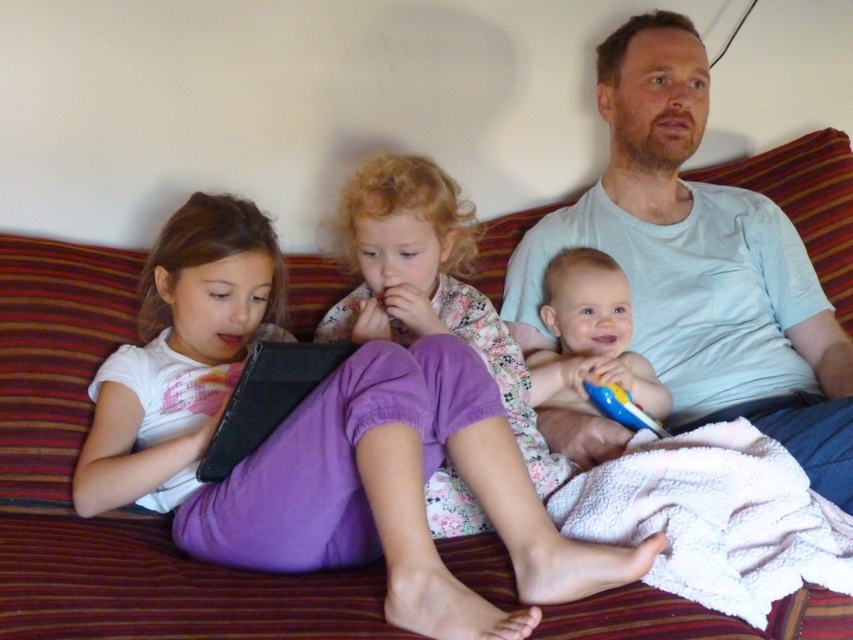
Looking at this image, who is positioned more to the right, purple cotton pants at lower left or smooth plastic toy at center?

smooth plastic toy at center

Who is taller, purple cotton pants at lower left or smooth plastic toy at center?

purple cotton pants at lower left

Between point (407, 380) and point (554, 413), which one is positioned in front?

Positioned in front is point (407, 380).

Image resolution: width=853 pixels, height=640 pixels. I want to click on purple cotton pants at lower left, so click(323, 445).

Which is below, purple cotton pants at lower left or light blue t-shirt at upper right?

purple cotton pants at lower left is below.

Which is more to the right, purple cotton pants at lower left or light blue t-shirt at upper right?

Positioned to the right is light blue t-shirt at upper right.

Between point (527, 579) and point (646, 348), which one is positioned in front?

Point (527, 579) is more forward.

Where is `purple cotton pants at lower left`? Image resolution: width=853 pixels, height=640 pixels. purple cotton pants at lower left is located at coordinates (323, 445).

Identify the location of smooth plastic toy at center. This screenshot has width=853, height=640. (587, 355).